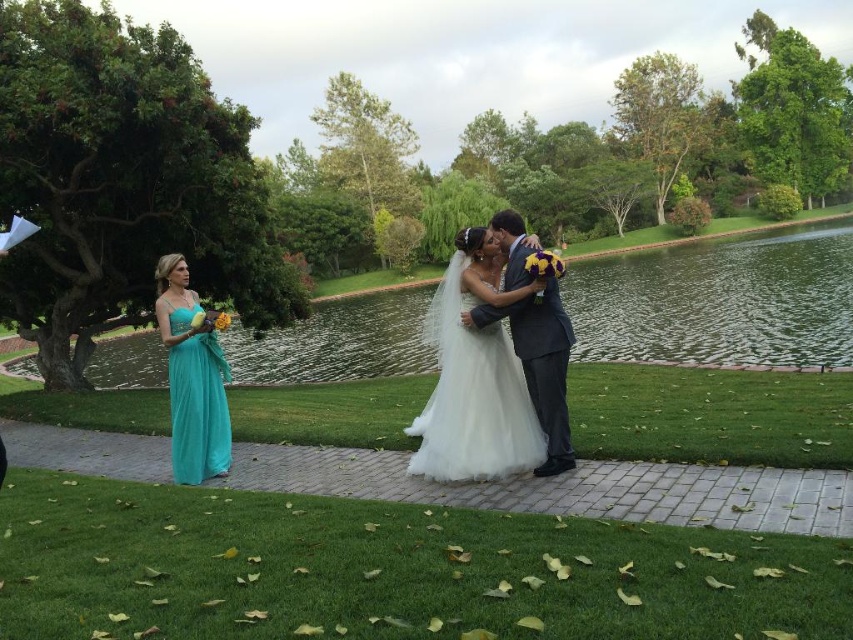
Is green reflective water at center thinner than white tulle dress at center?

In fact, green reflective water at center might be wider than white tulle dress at center.

Can you confirm if green reflective water at center is positioned above white tulle dress at center?

Yes, green reflective water at center is above white tulle dress at center.

The image size is (853, 640). What do you see at coordinates (720, 300) in the screenshot?
I see `green reflective water at center` at bounding box center [720, 300].

The image size is (853, 640). Find the location of `green reflective water at center`. green reflective water at center is located at coordinates (720, 300).

Between point (450, 353) and point (161, 328), which one is positioned behind?

The point (161, 328) is behind.

Can you confirm if white tulle dress at center is positioned to the left of teal satin dress at left?

Incorrect, white tulle dress at center is not on the left side of teal satin dress at left.

Image resolution: width=853 pixels, height=640 pixels. Describe the element at coordinates (476, 376) in the screenshot. I see `white tulle dress at center` at that location.

Locate an element on the screen. The image size is (853, 640). white tulle dress at center is located at coordinates (476, 376).

Can you confirm if green reflective water at center is smaller than teal satin dress at left?

No, green reflective water at center is not smaller than teal satin dress at left.

Who is lower down, green reflective water at center or teal satin dress at left?

teal satin dress at left is lower down.

Locate an element on the screen. The image size is (853, 640). green reflective water at center is located at coordinates (720, 300).